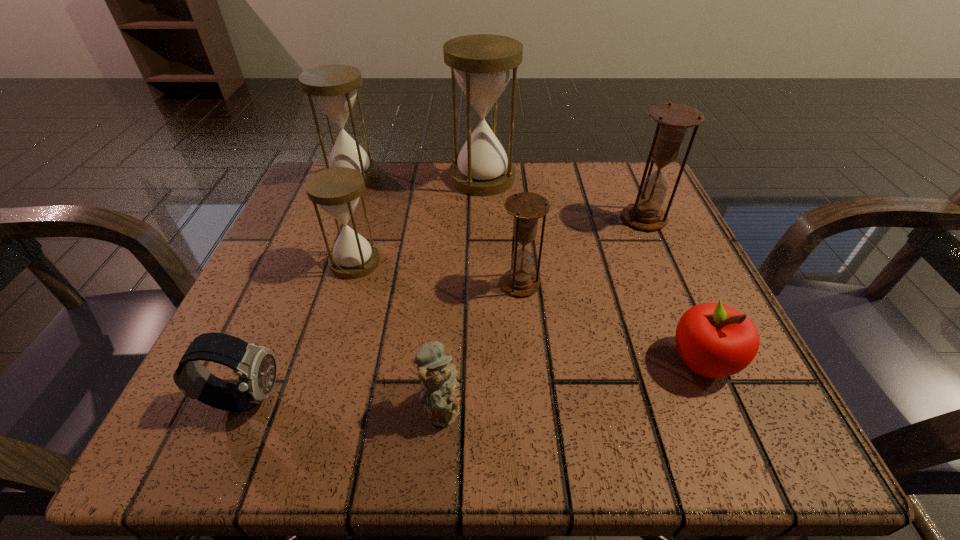
This screenshot has width=960, height=540. What are the coordinates of `watch` in the screenshot? It's located at (256, 367).

You are a GUI agent. You are given a task and a screenshot of the screen. Output one action in this format:
    pyautogui.click(x=<x>, y=<y>)
    Task: Click on the blank space located on the left of the biggest white hourglass
    Image resolution: width=960 pixels, height=540 pixels.
    Given the screenshot: What is the action you would take?
    tap(308, 178)

In order to click on vacant space located on the front of the second biggest white hourglass in this screenshot , I will do `click(312, 278)`.

Image resolution: width=960 pixels, height=540 pixels. Identify the location of free spot located on the front of the third nearest hourglass. (715, 379).

In order to click on vacant position located on the back of the left brown hourglass in this screenshot , I will do `click(515, 224)`.

Identify the location of vacant space located on the back of the nearest white hourglass. The width and height of the screenshot is (960, 540). (366, 226).

Identify the location of free space located 0.380m on the front-facing side of the blue teddy bear. [756, 407].

This screenshot has width=960, height=540. What are the coordinates of `vacant space located 0.340m on the back of the apple` in the screenshot? It's located at (634, 202).

In order to click on free space located 0.110m on the face of the dark watch in this screenshot , I will do `click(366, 399)`.

This screenshot has height=540, width=960. What are the coordinates of `teddy bear that is positioned at the near edge` in the screenshot? It's located at (438, 393).